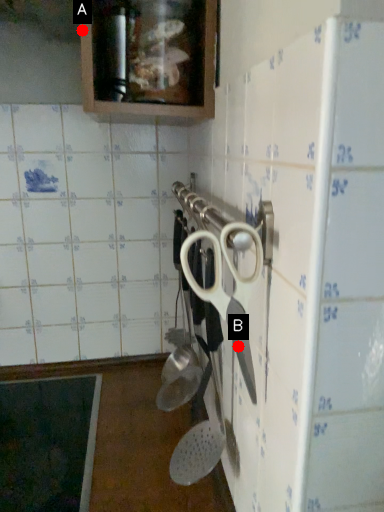
Question: Two points are circled on the image, labeled by A and B beside each circle. Which point is closer to the camera?

Choices:
 (A) A is closer
 (B) B is closer

Answer: (B)